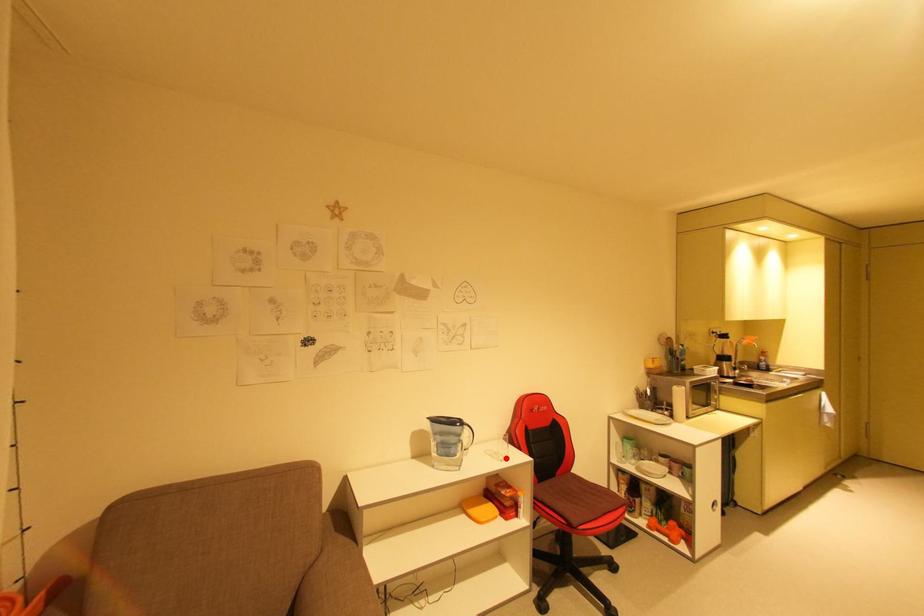
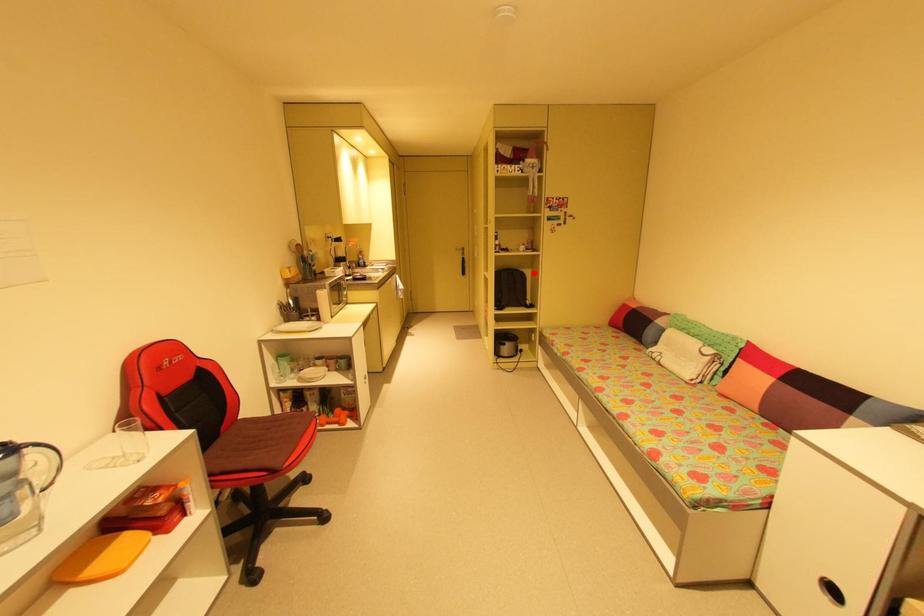
I am providing you with two images of the same scene from different viewpoints. A red point is marked on the first image and another point is marked on the second image. Does the point marked in image1 correspond to the same location as the one in image2?

No